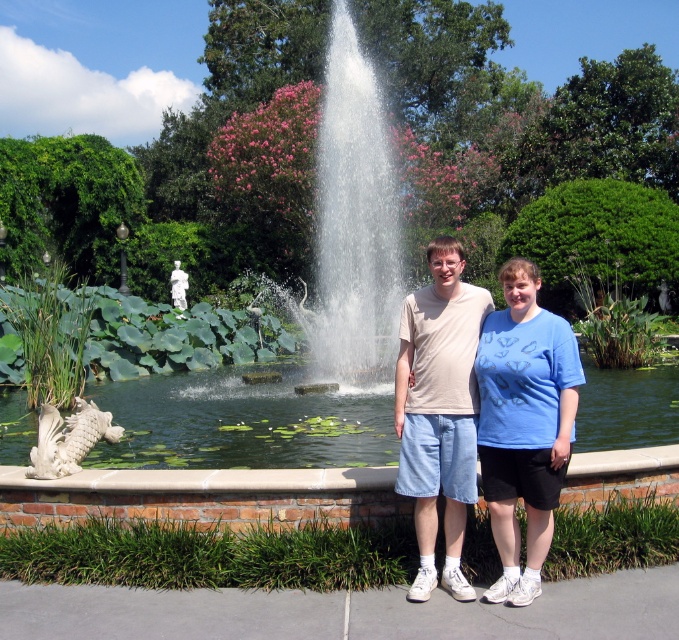
At what (x,y) coordinates should I click in order to perform the action: click on green leafy pond at center. Please return your answer as a coordinate pair (x, y). This screenshot has width=679, height=640. Looking at the image, I should click on (240, 422).

Does green leafy pond at center appear over matte beige t-shirt at center?

Actually, green leafy pond at center is below matte beige t-shirt at center.

Identify the location of green leafy pond at center. This screenshot has height=640, width=679. (240, 422).